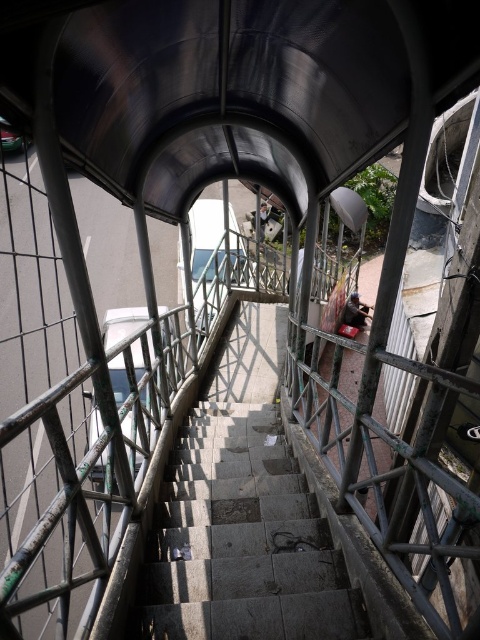
Question: Is gray concrete stairs at center positioned at the back of metallic silver skateboard at center?

Choices:
 (A) no
 (B) yes

Answer: (A)

Question: Which of the following is the farthest from the observer?

Choices:
 (A) metallic silver skateboard at center
 (B) gray concrete stairs at center

Answer: (A)

Question: Which of the following is the farthest from the observer?

Choices:
 (A) (253, 552)
 (B) (348, 321)

Answer: (B)

Question: Can you confirm if gray concrete stairs at center is smaller than metallic silver skateboard at center?

Choices:
 (A) no
 (B) yes

Answer: (B)

Question: Does gray concrete stairs at center come behind metallic silver skateboard at center?

Choices:
 (A) yes
 (B) no

Answer: (B)